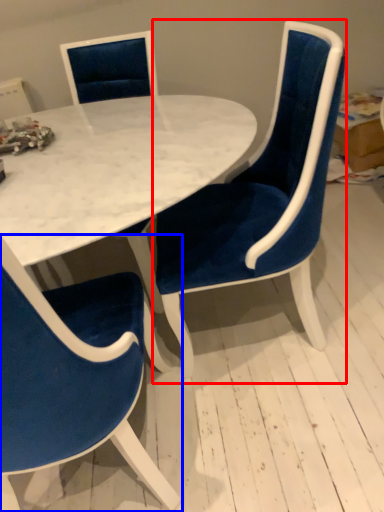
Question: Which of the following is the farthest to the observer, chair (highlighted by a red box) or chair (highlighted by a blue box)?

Choices:
 (A) chair
 (B) chair

Answer: (A)